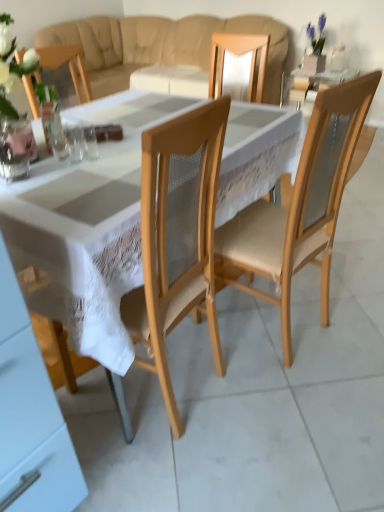
Identify the location of vacant area that is in front of clear glass vase at lower left. The image size is (384, 512). (24, 195).